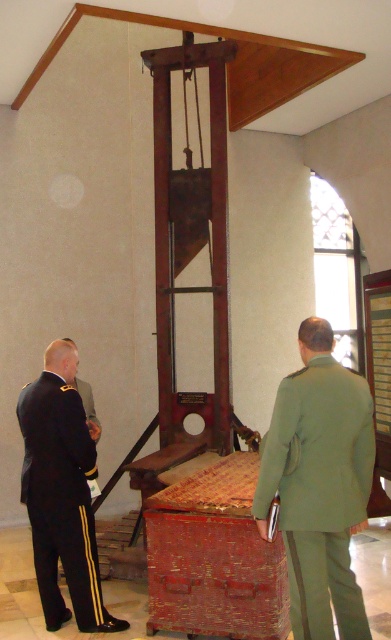
You are a tour guide leading a group through a historical museum. You notice two mannequins dressed in historical uniforms. One is wearing a green uniform at center and the other a black uniform at left. Your group asks if they can take a photo between the two uniforms. Considering the space between them, is there enough room for a person to stand comfortably? Please explain.

The green uniform at center and black uniform at left are 1.29 meters apart from each other. A person typically requires about 0.5 meters of personal space, so 1.29 meters is more than enough room to stand comfortably between them for a photo.

You are standing in the museum and see two points marked on the floor. The first point is at coordinate point[272,467] and the second point is at coordinate point[25,461]. Which point is closer to the guillotine?

Point[272,467] is in front of point[25,461], so it is closer to the guillotine.